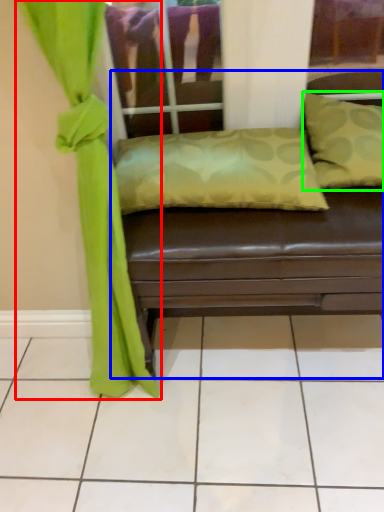
Question: Considering the real-world distances, which object is farthest from curtain (highlighted by a red box)? studio couch (highlighted by a blue box) or pillow (highlighted by a green box)?

Choices:
 (A) studio couch
 (B) pillow

Answer: (B)